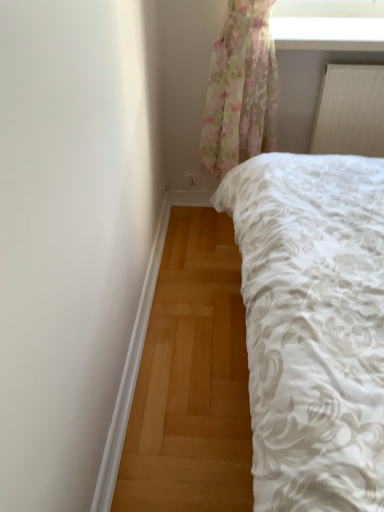
What do you see at coordinates (350, 111) in the screenshot? I see `white matte radiator at upper right` at bounding box center [350, 111].

This screenshot has height=512, width=384. What do you see at coordinates (130, 369) in the screenshot?
I see `white smooth trim at lower left` at bounding box center [130, 369].

At what (x,y) coordinates should I click in order to perform the action: click on white matte radiator at upper right. Please return your answer as a coordinate pair (x, y). This screenshot has width=384, height=512. Looking at the image, I should click on (350, 111).

Is white smooth trim at lower left to the left or to the right of white matte radiator at upper right in the image?

Based on their positions, white smooth trim at lower left is located to the left of white matte radiator at upper right.

Are white smooth trim at lower left and white matte radiator at upper right beside each other?

No.

From a real-world perspective, is white smooth trim at lower left located beneath white matte radiator at upper right?

Yes, from a real-world perspective, white smooth trim at lower left is below white matte radiator at upper right.

Which object is further away from the camera, white smooth trim at lower left or white matte radiator at upper right?

white matte radiator at upper right is more distant.

Would you consider transparent floral curtain at upper center to be distant from white smooth trim at lower left?

That's not correct — transparent floral curtain at upper center is a little close to white smooth trim at lower left.

Can you tell me how much transparent floral curtain at upper center and white smooth trim at lower left differ in facing direction?

There is a 89.4-degree angle between the facing directions of transparent floral curtain at upper center and white smooth trim at lower left.

From the image's perspective, is transparent floral curtain at upper center located above white smooth trim at lower left?

Indeed, from the image's perspective, transparent floral curtain at upper center is shown above white smooth trim at lower left.

From a real-world perspective, relative to white smooth trim at lower left, is transparent floral curtain at upper center vertically above or below?

transparent floral curtain at upper center is above white smooth trim at lower left.

From the image's perspective, which is above, white smooth trim at lower left or transparent floral curtain at upper center?

transparent floral curtain at upper center is shown above in the image.

Is white smooth trim at lower left facing towards transparent floral curtain at upper center?

No, white smooth trim at lower left is not aimed at transparent floral curtain at upper center.

Is white matte radiator at upper right with white smooth trim at lower left?

No, white matte radiator at upper right is not in contact with white smooth trim at lower left.

Could you tell me if white matte radiator at upper right is turned towards white smooth trim at lower left?

No, white matte radiator at upper right is not turned towards white smooth trim at lower left.

There is a white smooth trim at lower left. Identify the location of radiator above it (from a real-world perspective). This screenshot has height=512, width=384. (350, 111).

Can you confirm if white matte radiator at upper right is positioned to the left of white smooth trim at lower left?

No, white matte radiator at upper right is not to the left of white smooth trim at lower left.

How distant is white matte radiator at upper right from transparent floral curtain at upper center?

10.35 inches.

In terms of size, does white matte radiator at upper right appear bigger or smaller than transparent floral curtain at upper center?

In the image, white matte radiator at upper right appears to be smaller than transparent floral curtain at upper center.

Considering the points (326, 151) and (272, 30), which point is behind, point (326, 151) or point (272, 30)?

The point (326, 151) is more distant.

Is white matte radiator at upper right spatially inside transparent floral curtain at upper center, or outside of it?

white matte radiator at upper right lies outside transparent floral curtain at upper center.

In terms of width, does transparent floral curtain at upper center look wider or thinner when compared to white matte radiator at upper right?

Clearly, transparent floral curtain at upper center has more width compared to white matte radiator at upper right.

Is transparent floral curtain at upper center facing away from white matte radiator at upper right?

transparent floral curtain at upper center does not have its back to white matte radiator at upper right.

What's the angular difference between transparent floral curtain at upper center and white matte radiator at upper right's facing directions?

The facing directions of transparent floral curtain at upper center and white matte radiator at upper right are 0.858 degrees apart.

Considering the positions of point (362, 35) and point (313, 152), is point (362, 35) closer or farther from the camera than point (313, 152)?

Point (362, 35) appears to be closer to the viewer than point (313, 152).

Find the location of a particular element. The image size is (384, 512). radiator on the right side of white smooth trim at lower left is located at coordinates (350, 111).

Find the location of `trim below the transparent floral curtain at upper center (from a real-world perspective)`. trim below the transparent floral curtain at upper center (from a real-world perspective) is located at coordinates (130, 369).

From the picture: Looking at the image, which one is located further to white matte radiator at upper right, white smooth trim at lower left or transparent floral curtain at upper center?

white smooth trim at lower left is positioned further to the anchor white matte radiator at upper right.

From the image, which object appears to be nearer to white smooth trim at lower left, white matte radiator at upper right or transparent floral curtain at upper center?

white matte radiator at upper right is positioned closer to the anchor white smooth trim at lower left.

Estimate the real-world distances between objects in this image. Which object is closer to white matte radiator at upper right, transparent floral curtain at upper center or white smooth trim at lower left?

Based on the image, transparent floral curtain at upper center appears to be nearer to white matte radiator at upper right.

When comparing their distances from transparent floral curtain at upper center, does white matte radiator at upper right or white smooth trim at lower left seem further?

white smooth trim at lower left lies further to transparent floral curtain at upper center than the other object.

Estimate the real-world distances between objects in this image. Which object is closer to transparent floral curtain at upper center, white smooth trim at lower left or white matte radiator at upper right?

Based on the image, white matte radiator at upper right appears to be nearer to transparent floral curtain at upper center.

Considering their positions, is transparent floral curtain at upper center positioned closer to white smooth trim at lower left than white matte radiator at upper right?

Among the two, white matte radiator at upper right is located nearer to white smooth trim at lower left.

I want to click on radiator between transparent floral curtain at upper center and white smooth trim at lower left vertically, so click(x=350, y=111).